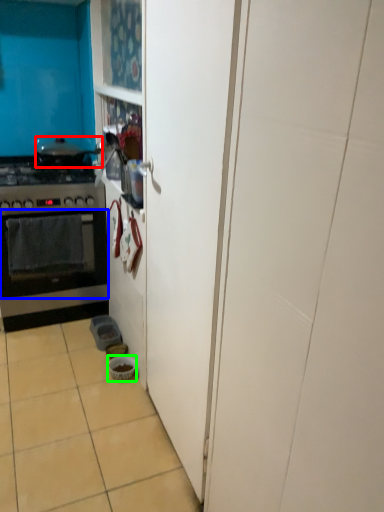
Question: Based on their relative distances, which object is farther from pot/pan (highlighted by a red box)? Choose from oven (highlighted by a blue box) and bowl (highlighted by a green box).

Choices:
 (A) oven
 (B) bowl

Answer: (B)